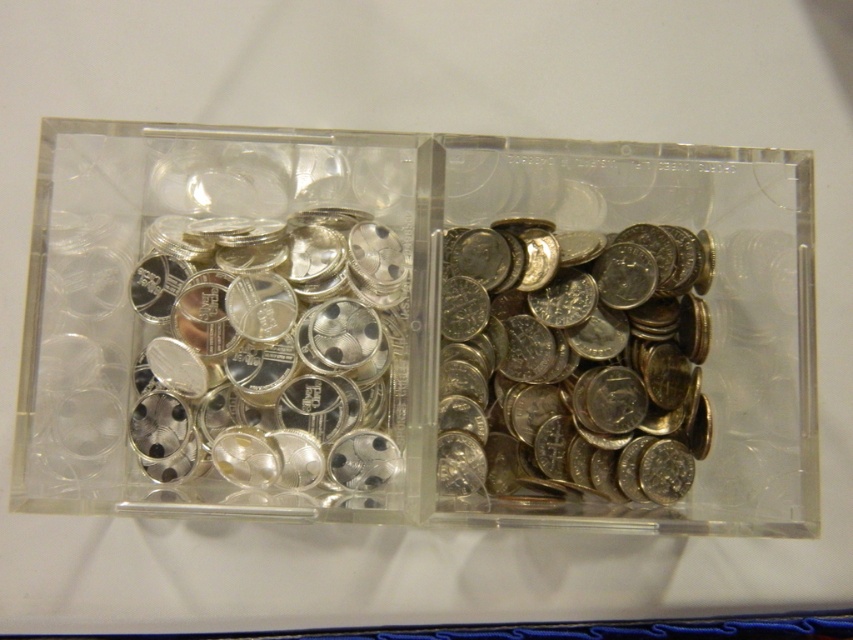
Based on the photo, you are looking at the two coin holders. There are two points marked in the image. One is at point (743,436) and the other is at point (453,248). Which point is closer to you?

Point (743,436) is closer to the viewer than point (453,248).